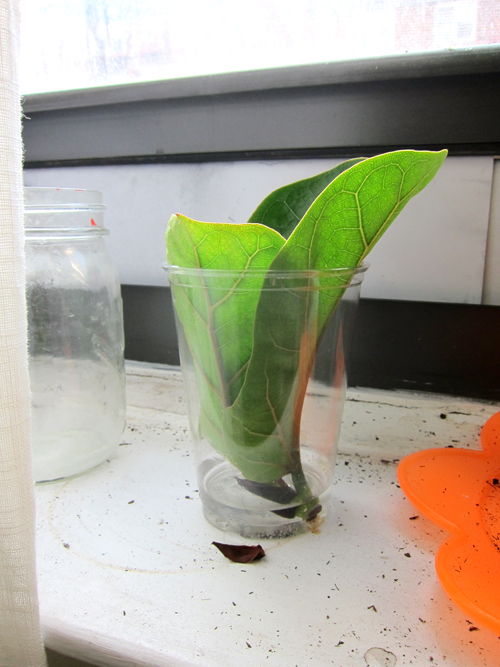
The image size is (500, 667). I want to click on jar, so click(71, 313).